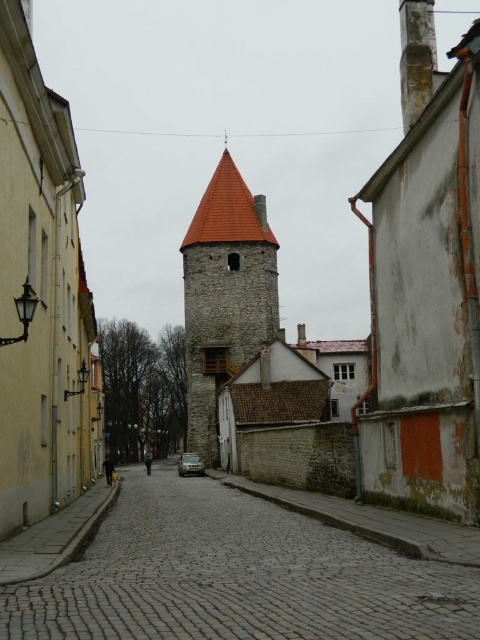
Is cobblestone street at center above smooth stone bell tower at center?

Actually, cobblestone street at center is below smooth stone bell tower at center.

Which is more to the left, cobblestone street at center or smooth stone bell tower at center?

smooth stone bell tower at center

Who is more forward, (263, 582) or (197, 426)?

Point (263, 582)

Where is `cobblestone street at center`? The image size is (480, 640). cobblestone street at center is located at coordinates (235, 577).